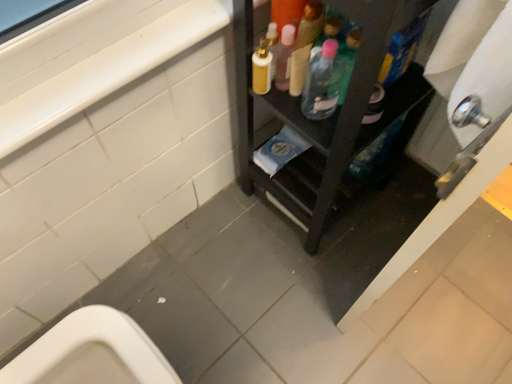
Question: Choose the correct answer: Is black wood shelf at center inside translucent plastic bottle at upper center, the first bottle from the right, or outside it?

Choices:
 (A) outside
 (B) inside

Answer: (A)

Question: Is black wood shelf at center wider or thinner than translucent plastic bottle at upper center, the first bottle from the right?

Choices:
 (A) wide
 (B) thin

Answer: (A)

Question: Based on their relative distances, which object is nearer to the translucent plastic bottle at center, marked as the 2th bottle in a right-to-left arrangement?

Choices:
 (A) black wood shelf at center
 (B) translucent plastic bottle at upper center, the first bottle from the right

Answer: (B)

Question: Which of these objects is positioned closest to the black wood shelf at center?

Choices:
 (A) translucent plastic bottle at center, marked as the 2th bottle in a right-to-left arrangement
 (B) translucent plastic bottle at upper center, the first bottle from the right

Answer: (A)